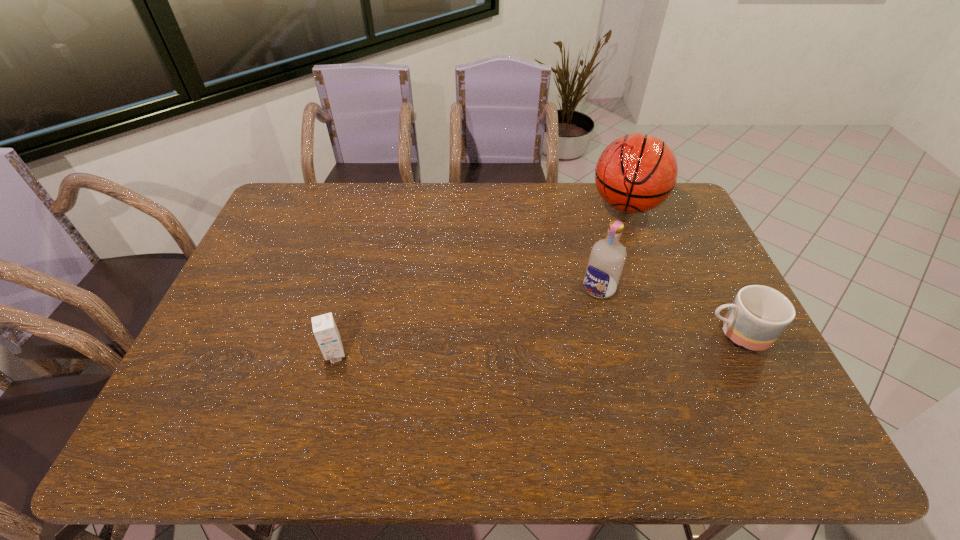
Image resolution: width=960 pixels, height=540 pixels. Identify the location of vacant region located 0.190m on the side with spill of the basketball. (596, 260).

Where is `vacant point located on the label of the vodka`? The height and width of the screenshot is (540, 960). vacant point located on the label of the vodka is located at coordinates (510, 387).

I want to click on blank space located 0.300m on the label of the vodka, so click(529, 366).

The image size is (960, 540). In order to click on vacant space situated on the label of the vodka in this screenshot , I will do `click(536, 358)`.

The image size is (960, 540). Find the location of `object positioned at the far edge`. object positioned at the far edge is located at coordinates (637, 172).

This screenshot has width=960, height=540. I want to click on mug positioned at the right edge, so click(x=758, y=315).

The image size is (960, 540). I want to click on basketball located at the right edge, so 637,172.

The width and height of the screenshot is (960, 540). Find the location of `object that is positioned at the far right corner`. object that is positioned at the far right corner is located at coordinates (637, 172).

Locate an element on the screen. This screenshot has width=960, height=540. vacant space at the far edge is located at coordinates (577, 222).

At what (x,y) coordinates should I click in order to perform the action: click on vacant space at the near edge. Please return your answer as a coordinate pair (x, y). Looking at the image, I should click on (617, 407).